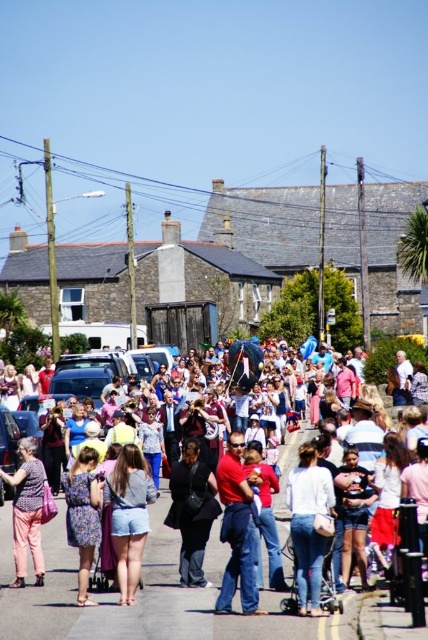
You are standing on the street and see the white cotton crowd at center and the denim shorts at center. Which one is positioned to the right?

The white cotton crowd at center is to the right of denim shorts at center.

You are a photographer standing at the edge of the street, and you want to capture both the white cotton crowd at center and the dusty purple dress at lower left in a single photo. Based on their heights, which object will appear larger in the photo?

The white cotton crowd at center will appear larger in the photo because it has a greater height compared to the dusty purple dress at lower left.